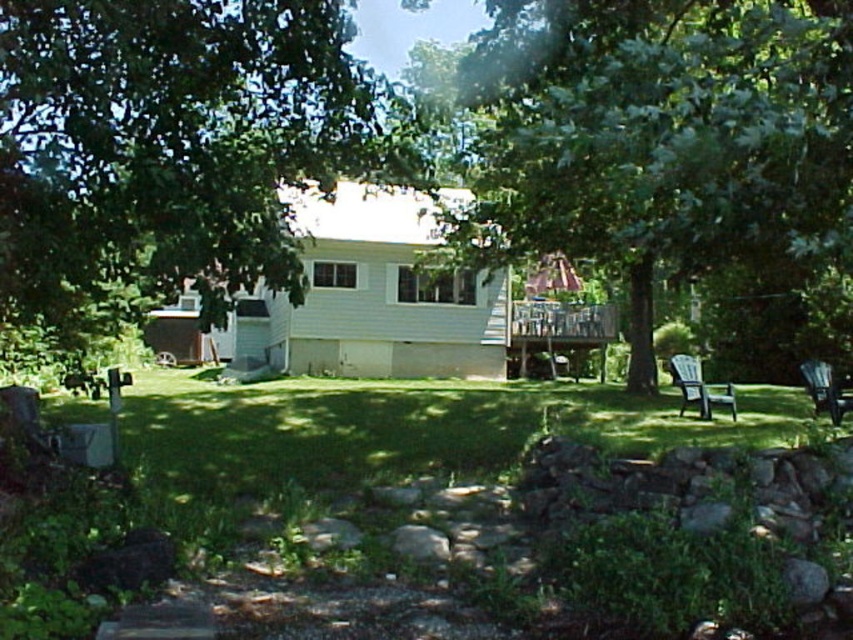
Question: Which of the following is the closest to the observer?

Choices:
 (A) (399, 381)
 (B) (289, 125)
 (C) (825, 362)

Answer: (B)

Question: From the image, what is the correct spatial relationship of green grass at center in relation to green plastic chair at right?

Choices:
 (A) left
 (B) right

Answer: (A)

Question: Is green leafy tree at upper left bigger than black plastic chair at lower right?

Choices:
 (A) yes
 (B) no

Answer: (B)

Question: Which object appears farthest from the camera in this image?

Choices:
 (A) green grass at center
 (B) green leafy tree at upper left
 (C) black plastic chair at lower right
 (D) green leafy tree at center

Answer: (C)

Question: Can you confirm if green leafy tree at upper left is positioned below black plastic chair at lower right?

Choices:
 (A) yes
 (B) no

Answer: (B)

Question: Which of the following is the farthest from the observer?

Choices:
 (A) (822, 410)
 (B) (688, 378)
 (C) (486, 100)

Answer: (B)